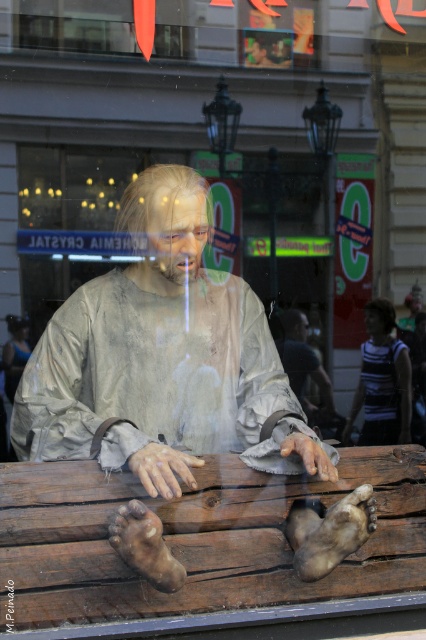
Is matte gray mannequin at center thinner than brown wooden bench at lower center?

Correct, matte gray mannequin at center's width is less than brown wooden bench at lower center's.

Is point (126, 353) positioned before point (400, 529)?

No.

I want to click on matte gray mannequin at center, so click(x=163, y=360).

Identify the location of matte gray mannequin at center. (163, 360).

Who is taller, matte gray mannequin at center or striped fabric shirt at center?

With more height is matte gray mannequin at center.

Is matte gray mannequin at center to the left of striped fabric shirt at center from the viewer's perspective?

Yes, matte gray mannequin at center is to the left of striped fabric shirt at center.

Is point (89, 328) in front of point (399, 408)?

Yes, point (89, 328) is closer to viewer.

Locate an element on the screen. This screenshot has width=426, height=640. matte gray mannequin at center is located at coordinates (163, 360).

Who is positioned more to the right, brown wooden bench at lower center or striped fabric shirt at center?

Positioned to the right is striped fabric shirt at center.

Who is shorter, brown wooden bench at lower center or striped fabric shirt at center?

With less height is brown wooden bench at lower center.

Is point (37, 541) closer to camera compared to point (379, 392)?

That is True.

The width and height of the screenshot is (426, 640). I want to click on brown wooden bench at lower center, so click(x=196, y=538).